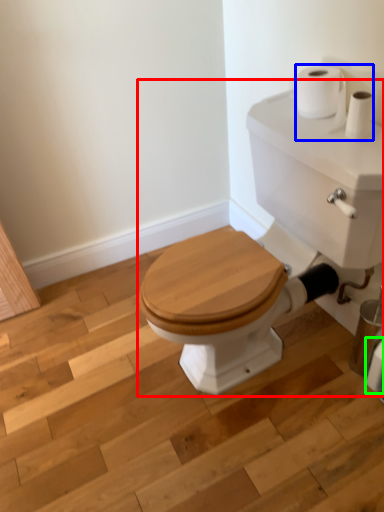
Question: Based on their relative distances, which object is nearer to porcelain (highlighted by a red box)? Choose from toilet paper (highlighted by a blue box) and toilet paper (highlighted by a green box).

Choices:
 (A) toilet paper
 (B) toilet paper

Answer: (A)